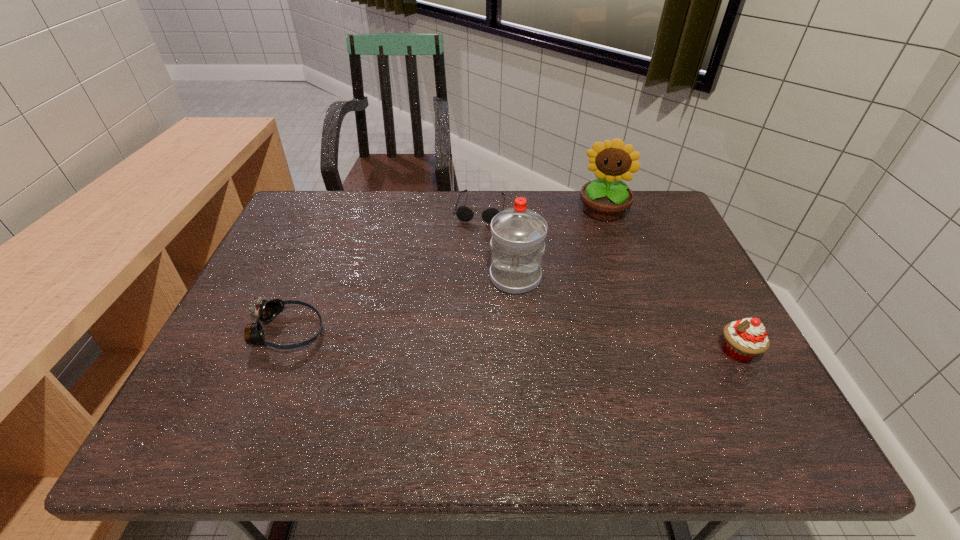
Identify the location of vacant space located 0.310m on the face of the second object from right to left. (582, 294).

I want to click on vacant space located on the handle side of the third farthest object, so click(497, 396).

This screenshot has height=540, width=960. In order to click on blank area located 0.270m on the handle side of the third farthest object in this screenshot , I will do `click(499, 388)`.

You are a GUI agent. You are given a task and a screenshot of the screen. Output one action in this format:
    pyautogui.click(x=<x>, y=<y>)
    Task: Click on the free space located 0.140m on the handle side of the third farthest object
    This screenshot has width=960, height=540.
    Given the screenshot: What is the action you would take?
    pyautogui.click(x=506, y=339)

Where is `vacant space located on the front-facing side of the shortest object`? vacant space located on the front-facing side of the shortest object is located at coordinates (465, 274).

At what (x,y) coordinates should I click in order to perform the action: click on vacant space located 0.320m on the front-facing side of the shortest object. Please return your answer as a coordinate pair (x, y). The image size is (960, 540). Looking at the image, I should click on (459, 301).

Where is `vacant space located on the front-facing side of the shortest object`? Image resolution: width=960 pixels, height=540 pixels. vacant space located on the front-facing side of the shortest object is located at coordinates (470, 252).

This screenshot has width=960, height=540. Find the location of `sunflower that is at the far edge`. sunflower that is at the far edge is located at coordinates (606, 199).

The image size is (960, 540). Identify the location of sunglasses that is at the far edge. (463, 213).

Find the location of `object present at the near edge`. object present at the near edge is located at coordinates (745, 339).